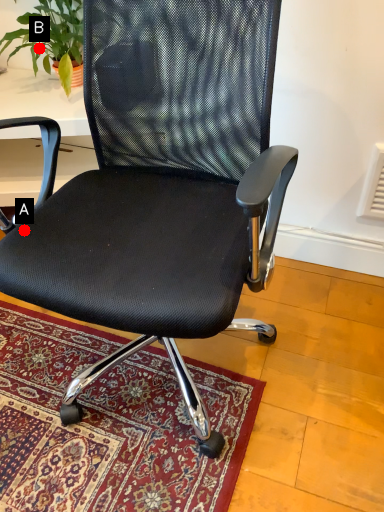
Question: Two points are circled on the image, labeled by A and B beside each circle. Which point is further to the camera?

Choices:
 (A) A is further
 (B) B is further

Answer: (B)